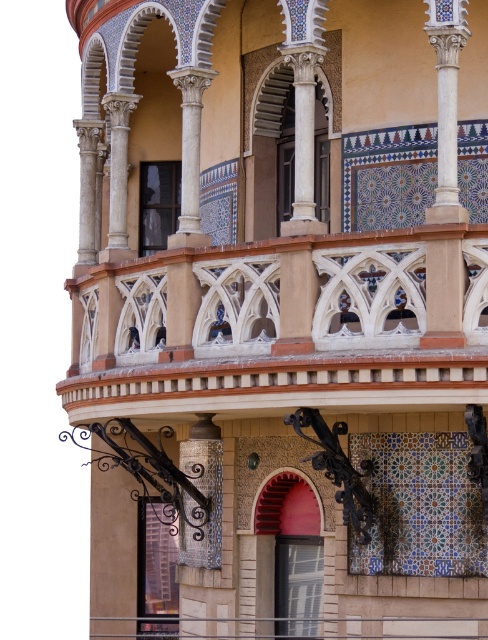
You are standing in front of the building and want to locate the matte glass window at lower center. According to the coordinates provided, where exactly is it positioned?

The matte glass window at lower center is located at point coordinates of 0.892 on the x axis and 0.320 on the y axis.

You are an architect designing a new building and want to ensure that the white stone balcony at center and the matte glass window at lower center are proportionate. Based on the image, which object is taller?

The white stone balcony at center is taller than the matte glass window at lower center according to the description.